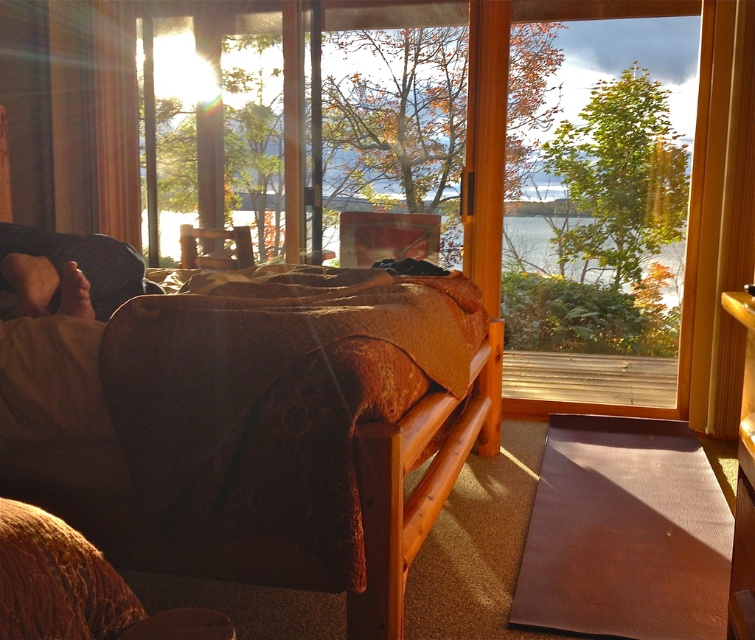
Is transparent glass window at center smaller than velvet brown couch at lower left?

Actually, transparent glass window at center might be larger than velvet brown couch at lower left.

The height and width of the screenshot is (640, 755). Find the location of `transparent glass window at center`. transparent glass window at center is located at coordinates (584, 388).

In order to click on transparent glass window at center in this screenshot , I will do `click(584, 388)`.

Between point (339, 259) and point (32, 230), which one is positioned in front?

Point (32, 230)

At what (x,y) coordinates should I click in order to perform the action: click on transparent glass window at center. Please return your answer as a coordinate pair (x, y). This screenshot has width=755, height=640. Looking at the image, I should click on (584, 388).

Is brown matte yoga mat at lower right closer to the viewer compared to brown textured fabric at left?

Yes, it is.

Between point (566, 420) and point (88, 236), which one is positioned in front?

Positioned in front is point (88, 236).

Is point (641, 541) more distant than point (76, 250)?

No, it is not.

The width and height of the screenshot is (755, 640). Identify the location of brown matte yoga mat at lower right. [x=624, y=532].